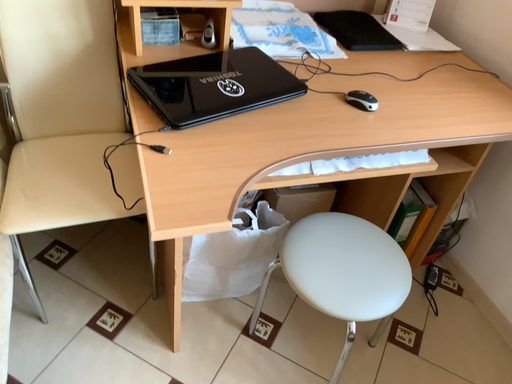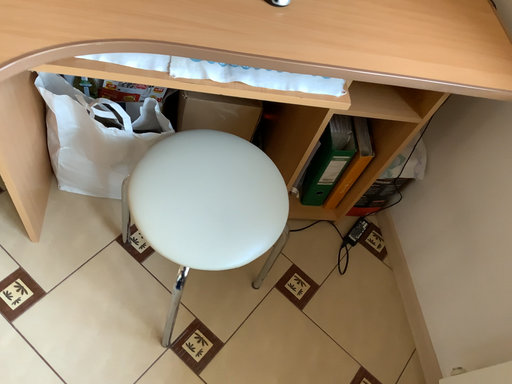
Question: Which way did the camera rotate in the video?

Choices:
 (A) rotated upward
 (B) rotated downward

Answer: (B)